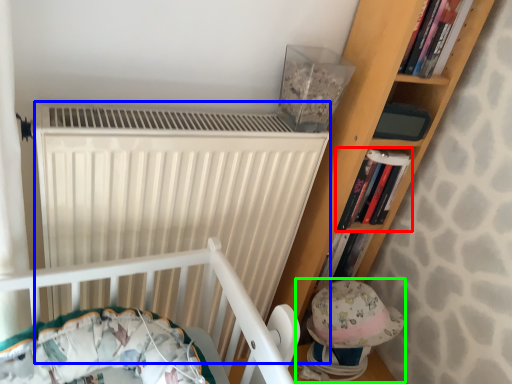
Question: Based on their relative distances, which object is nearer to book (highlighted by a red box)? Choose from radiator (highlighted by a blue box) and toy (highlighted by a green box).

Choices:
 (A) radiator
 (B) toy

Answer: (B)